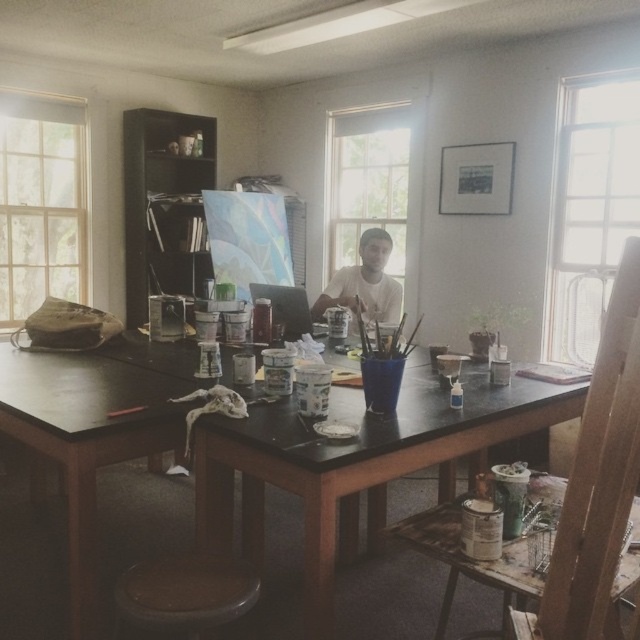
You are an artist who needs to place a new canvas on the black matte table at center. Considering the brown wooden stool at lower center is currently occupying some space, can you determine if there is enough room on the table to place the canvas without moving the stool?

The black matte table at center might be wider than brown wooden stool at lower center, so there could be enough space to place the canvas without moving the stool, but it depends on the exact dimensions and arrangement of both objects.

You are an artist standing at the entrance of the studio. You want to place a 4.5 feet long canvas on the black matte table at center. Can you fit the canvas on the table?

The black matte table at center is 5.06 feet away from the camera, but the distance does not indicate the table size. The question about fitting the canvas cannot be answered with the given information.

You are an artist who just finished painting and wants to hang your white matte shirt at center on a hook located near the brown wooden stool at lower center. Can you reach the hook without moving the stool?

The brown wooden stool at lower center and white matte shirt at center are 2.23 meters apart from each other. Since the distance is over 2 meters, you would need to move either the stool or the shirt to reach the hook.